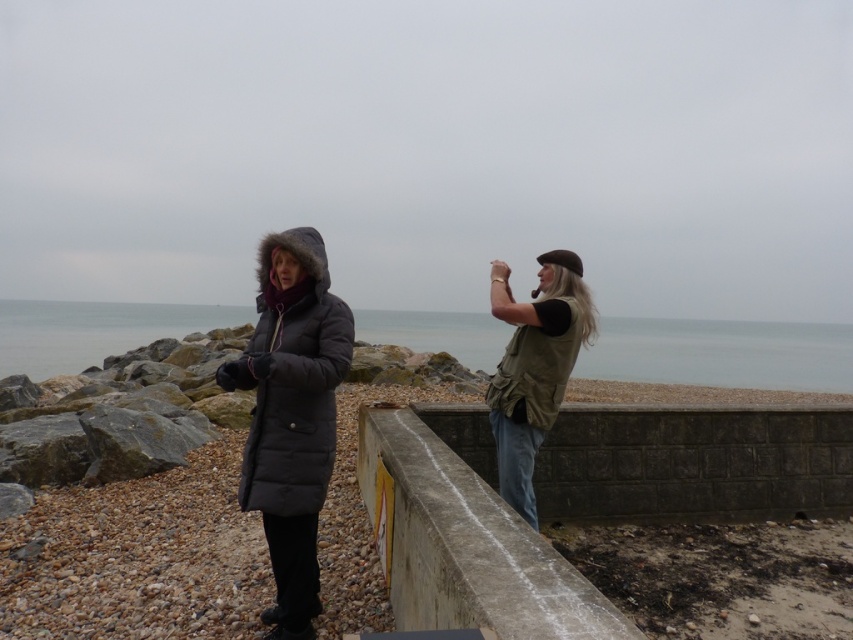
I want to click on gray water at center, so click(722, 353).

Is point (321, 349) farther from viewer compared to point (496, 307)?

No.

Does point (254, 460) come closer to viewer compared to point (527, 449)?

Yes, point (254, 460) is closer to viewer.

What are the coordinates of `matte black coat at center` in the screenshot? It's located at (291, 413).

In the scene shown: Is concrete ledge at center positioned before matte black coat at center?

Yes, it is.

Does concrete ledge at center appear on the right side of matte black coat at center?

Yes, concrete ledge at center is to the right of matte black coat at center.

Between point (416, 554) and point (306, 358), which one is positioned in front?

Point (416, 554) is more forward.

This screenshot has height=640, width=853. Find the location of `concrete ledge at center`. concrete ledge at center is located at coordinates (465, 536).